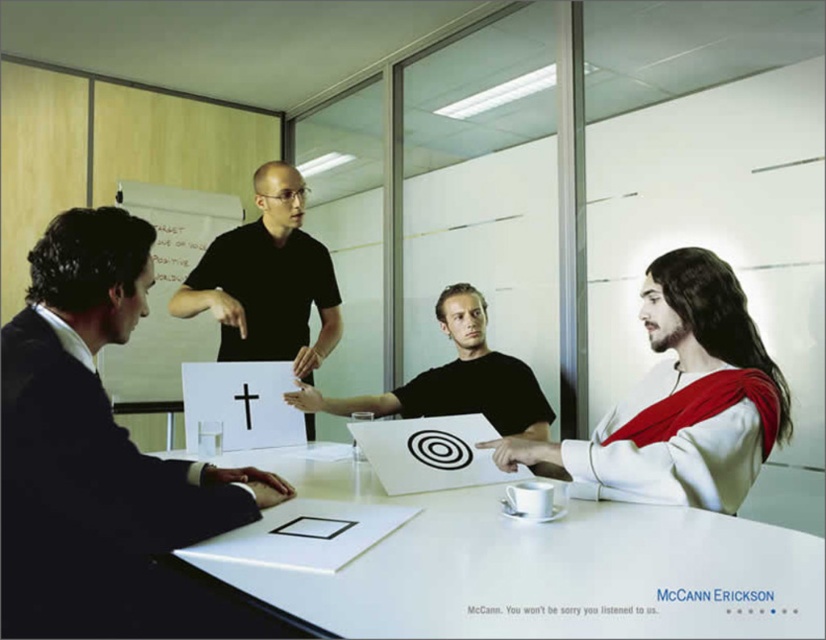
Does white glossy table at center appear on the right side of white matte jesus at right?

No, white glossy table at center is not to the right of white matte jesus at right.

Which of these two, white glossy table at center or white matte jesus at right, stands taller?

Standing taller between the two is white matte jesus at right.

This screenshot has height=640, width=826. Find the location of `white glossy table at center`. white glossy table at center is located at coordinates (539, 568).

I want to click on white glossy table at center, so click(539, 568).

Can you confirm if white glossy table at center is thinner than black matte paper at center?

Incorrect, white glossy table at center's width is not less than black matte paper at center's.

In the scene shown: How far apart are white glossy table at center and black matte paper at center?

white glossy table at center and black matte paper at center are 29.02 inches apart.

Image resolution: width=826 pixels, height=640 pixels. In order to click on white glossy table at center in this screenshot , I will do `click(539, 568)`.

Find the location of a particular element. The image size is (826, 640). white glossy table at center is located at coordinates (539, 568).

Is the position of white glossy table at center less distant than that of black matte shirt at upper center?

Yes, white glossy table at center is closer to the viewer.

Looking at this image, does white glossy table at center have a lesser width compared to black matte shirt at upper center?

Incorrect, white glossy table at center's width is not less than black matte shirt at upper center's.

Does point (345, 461) come behind point (50, 396)?

That is True.

This screenshot has height=640, width=826. I want to click on white glossy table at center, so click(539, 568).